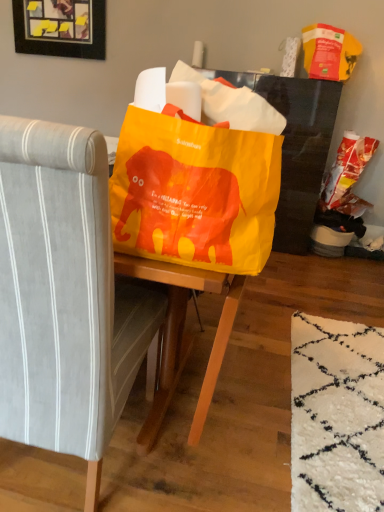
At what (x,y) coordinates should I click in order to perform the action: click on yellow plastic grocery bag at upper right, arranged as the first grocery bag when viewed from the top. Please return your answer as a coordinate pair (x, y). Looking at the image, I should click on (329, 52).

Describe the element at coordinates (329, 52) in the screenshot. Image resolution: width=384 pixels, height=512 pixels. I see `yellow plastic grocery bag at upper right, acting as the 2th grocery bag starting from the bottom` at that location.

From the picture: What is the approximate width of matte plastic grocery bag at right, placed as the 2th grocery bag when sorted from top to bottom?

The width of matte plastic grocery bag at right, placed as the 2th grocery bag when sorted from top to bottom, is 25.15 centimeters.

At what (x,y) coordinates should I click in order to perform the action: click on matte plastic grocery bag at right, which is the first grocery bag in bottom-to-top order. Please return your answer as a coordinate pair (x, y). Looking at the image, I should click on (348, 175).

This screenshot has width=384, height=512. I want to click on wooden frame with yellow sticky notes at upper left, so click(x=60, y=28).

Image resolution: width=384 pixels, height=512 pixels. Identify the location of yellow plastic grocery bag at upper right, acting as the 2th grocery bag starting from the bottom. (329, 52).

Which object is closer to the camera taking this photo, yellow plastic grocery bag at upper right, acting as the 2th grocery bag starting from the bottom, or wooden frame with yellow sticky notes at upper left?

yellow plastic grocery bag at upper right, acting as the 2th grocery bag starting from the bottom, is in front.

Consider the image. Is yellow plastic grocery bag at upper right, arranged as the first grocery bag when viewed from the top, positioned beyond the bounds of wooden frame with yellow sticky notes at upper left?

Yes, yellow plastic grocery bag at upper right, arranged as the first grocery bag when viewed from the top, is not within wooden frame with yellow sticky notes at upper left.

Looking at the image, does yellow plastic grocery bag at upper right, acting as the 2th grocery bag starting from the bottom, seem bigger or smaller compared to wooden frame with yellow sticky notes at upper left?

Considering their sizes, yellow plastic grocery bag at upper right, acting as the 2th grocery bag starting from the bottom, takes up more space than wooden frame with yellow sticky notes at upper left.

Consider the image. From the image's perspective, which one is positioned lower, wooden frame with yellow sticky notes at upper left or matte plastic grocery bag at right, which is the first grocery bag in bottom-to-top order?

From the image's view, matte plastic grocery bag at right, which is the first grocery bag in bottom-to-top order, is below.

Which of these two, wooden frame with yellow sticky notes at upper left or matte plastic grocery bag at right, placed as the 2th grocery bag when sorted from top to bottom, stands shorter?

wooden frame with yellow sticky notes at upper left is shorter.

Can you confirm if wooden frame with yellow sticky notes at upper left is thinner than matte plastic grocery bag at right, which is the first grocery bag in bottom-to-top order?

Yes.

Is wooden frame with yellow sticky notes at upper left positioned far away from matte plastic grocery bag at right, placed as the 2th grocery bag when sorted from top to bottom?

Yes, wooden frame with yellow sticky notes at upper left and matte plastic grocery bag at right, placed as the 2th grocery bag when sorted from top to bottom, are located far from each other.

Would you consider matte plastic grocery bag at right, placed as the 2th grocery bag when sorted from top to bottom, to be distant from gray fabric chair at center?

Yes, matte plastic grocery bag at right, placed as the 2th grocery bag when sorted from top to bottom, and gray fabric chair at center are quite far apart.

Considering the sizes of matte plastic grocery bag at right, which is the first grocery bag in bottom-to-top order, and gray fabric chair at center in the image, is matte plastic grocery bag at right, which is the first grocery bag in bottom-to-top order, wider or thinner than gray fabric chair at center?

matte plastic grocery bag at right, which is the first grocery bag in bottom-to-top order, is thinner than gray fabric chair at center.

Does matte plastic grocery bag at right, placed as the 2th grocery bag when sorted from top to bottom, appear on the left side of gray fabric chair at center?

Incorrect, matte plastic grocery bag at right, placed as the 2th grocery bag when sorted from top to bottom, is not on the left side of gray fabric chair at center.

Based on the photo, from the image's perspective, is matte plastic grocery bag at right, which is the first grocery bag in bottom-to-top order, beneath gray fabric chair at center?

No, from the image's perspective, matte plastic grocery bag at right, which is the first grocery bag in bottom-to-top order, is not beneath gray fabric chair at center.

Is point (97, 49) closer to viewer compared to point (325, 42)?

That is False.

How different are the orientations of wooden frame with yellow sticky notes at upper left and yellow plastic grocery bag at upper right, arranged as the first grocery bag when viewed from the top, in degrees?

0.00758 degrees separate the facing orientations of wooden frame with yellow sticky notes at upper left and yellow plastic grocery bag at upper right, arranged as the first grocery bag when viewed from the top.

Measure the distance between wooden frame with yellow sticky notes at upper left and yellow plastic grocery bag at upper right, acting as the 2th grocery bag starting from the bottom.

wooden frame with yellow sticky notes at upper left and yellow plastic grocery bag at upper right, acting as the 2th grocery bag starting from the bottom, are 6.35 feet apart.

Which object is positioned more to the left, wooden frame with yellow sticky notes at upper left or yellow plastic grocery bag at upper right, acting as the 2th grocery bag starting from the bottom?

Positioned to the left is wooden frame with yellow sticky notes at upper left.

Considering their positions, is matte plastic grocery bag at right, placed as the 2th grocery bag when sorted from top to bottom, located in front of or behind wooden frame with yellow sticky notes at upper left?

Visually, matte plastic grocery bag at right, placed as the 2th grocery bag when sorted from top to bottom, is located in front of wooden frame with yellow sticky notes at upper left.

From the image's perspective, relative to wooden frame with yellow sticky notes at upper left, is matte plastic grocery bag at right, which is the first grocery bag in bottom-to-top order, above or below?

Based on their image positions, matte plastic grocery bag at right, which is the first grocery bag in bottom-to-top order, is located beneath wooden frame with yellow sticky notes at upper left.

From a real-world perspective, who is located higher, matte plastic grocery bag at right, which is the first grocery bag in bottom-to-top order, or wooden frame with yellow sticky notes at upper left?

wooden frame with yellow sticky notes at upper left, from a real-world perspective.

Does point (347, 158) lie in front of point (73, 22)?

Yes, point (347, 158) is in front of point (73, 22).

From a real-world perspective, is matte plastic grocery bag at right, which is the first grocery bag in bottom-to-top order, physically above yellow plastic grocery bag at upper right, acting as the 2th grocery bag starting from the bottom?

No, from a real-world perspective, matte plastic grocery bag at right, which is the first grocery bag in bottom-to-top order, is not on top of yellow plastic grocery bag at upper right, acting as the 2th grocery bag starting from the bottom.

Considering the sizes of objects matte plastic grocery bag at right, which is the first grocery bag in bottom-to-top order, and yellow plastic grocery bag at upper right, acting as the 2th grocery bag starting from the bottom, in the image provided, who is shorter, matte plastic grocery bag at right, which is the first grocery bag in bottom-to-top order, or yellow plastic grocery bag at upper right, acting as the 2th grocery bag starting from the bottom,?

yellow plastic grocery bag at upper right, acting as the 2th grocery bag starting from the bottom.

Considering the relative positions of matte plastic grocery bag at right, placed as the 2th grocery bag when sorted from top to bottom, and yellow plastic grocery bag at upper right, acting as the 2th grocery bag starting from the bottom, in the image provided, is matte plastic grocery bag at right, placed as the 2th grocery bag when sorted from top to bottom, to the left or to the right of yellow plastic grocery bag at upper right, acting as the 2th grocery bag starting from the bottom,?

matte plastic grocery bag at right, placed as the 2th grocery bag when sorted from top to bottom, is positioned on yellow plastic grocery bag at upper right, acting as the 2th grocery bag starting from the bottom,'s right side.

Considering the sizes of matte plastic grocery bag at right, which is the first grocery bag in bottom-to-top order, and yellow plastic grocery bag at upper right, arranged as the first grocery bag when viewed from the top, in the image, is matte plastic grocery bag at right, which is the first grocery bag in bottom-to-top order, wider or thinner than yellow plastic grocery bag at upper right, arranged as the first grocery bag when viewed from the top,?

Clearly, matte plastic grocery bag at right, which is the first grocery bag in bottom-to-top order, has less width compared to yellow plastic grocery bag at upper right, arranged as the first grocery bag when viewed from the top.

Considering the relative sizes of wooden frame with yellow sticky notes at upper left and gray fabric chair at center in the image provided, is wooden frame with yellow sticky notes at upper left wider than gray fabric chair at center?

In fact, wooden frame with yellow sticky notes at upper left might be narrower than gray fabric chair at center.

Find the location of a particular element. chair on the right side of wooden frame with yellow sticky notes at upper left is located at coordinates (65, 297).

Does wooden frame with yellow sticky notes at upper left have a greater height compared to gray fabric chair at center?

In fact, wooden frame with yellow sticky notes at upper left may be shorter than gray fabric chair at center.

Based on the photo, is wooden frame with yellow sticky notes at upper left far away from gray fabric chair at center?

Indeed, wooden frame with yellow sticky notes at upper left is not near gray fabric chair at center.

At what (x,y) coordinates should I click in order to perform the action: click on the 1st grocery bag located beneath the wooden frame with yellow sticky notes at upper left (from a real-world perspective). Please return your answer as a coordinate pair (x, y). Looking at the image, I should click on (329, 52).

You are a GUI agent. You are given a task and a screenshot of the screen. Output one action in this format:
    pyautogui.click(x=<x>, y=<y>)
    Task: Click on the 2nd grocery bag to the right of the wooden frame with yellow sticky notes at upper left, starting your count from the anchor
    The height and width of the screenshot is (512, 384).
    Given the screenshot: What is the action you would take?
    pyautogui.click(x=348, y=175)

When comparing their distances from matte plastic grocery bag at right, placed as the 2th grocery bag when sorted from top to bottom, does gray fabric chair at center or yellow plastic grocery bag at upper right, acting as the 2th grocery bag starting from the bottom, seem further?

Among the two, gray fabric chair at center is located further to matte plastic grocery bag at right, placed as the 2th grocery bag when sorted from top to bottom.

Estimate the real-world distances between objects in this image. Which object is closer to matte plastic grocery bag at right, placed as the 2th grocery bag when sorted from top to bottom, wooden frame with yellow sticky notes at upper left or yellow plastic grocery bag at upper right, arranged as the first grocery bag when viewed from the top?

yellow plastic grocery bag at upper right, arranged as the first grocery bag when viewed from the top, is positioned closer to the anchor matte plastic grocery bag at right, placed as the 2th grocery bag when sorted from top to bottom.

Estimate the real-world distances between objects in this image. Which object is closer to gray fabric chair at center, matte plastic grocery bag at right, placed as the 2th grocery bag when sorted from top to bottom, or wooden frame with yellow sticky notes at upper left?

Based on the image, matte plastic grocery bag at right, placed as the 2th grocery bag when sorted from top to bottom, appears to be nearer to gray fabric chair at center.

From the image, which object appears to be farther from gray fabric chair at center, wooden frame with yellow sticky notes at upper left or yellow plastic grocery bag at upper right, arranged as the first grocery bag when viewed from the top?

wooden frame with yellow sticky notes at upper left lies further to gray fabric chair at center than the other object.

Which object lies further to the anchor point yellow plastic grocery bag at upper right, acting as the 2th grocery bag starting from the bottom, gray fabric chair at center or matte plastic grocery bag at right, placed as the 2th grocery bag when sorted from top to bottom?

gray fabric chair at center.

Which object lies nearer to the anchor point matte plastic grocery bag at right, placed as the 2th grocery bag when sorted from top to bottom, gray fabric chair at center or wooden frame with yellow sticky notes at upper left?

wooden frame with yellow sticky notes at upper left is positioned closer to the anchor matte plastic grocery bag at right, placed as the 2th grocery bag when sorted from top to bottom.

Considering their positions, is wooden frame with yellow sticky notes at upper left positioned closer to yellow plastic grocery bag at upper right, acting as the 2th grocery bag starting from the bottom, than gray fabric chair at center?

The object closer to yellow plastic grocery bag at upper right, acting as the 2th grocery bag starting from the bottom, is wooden frame with yellow sticky notes at upper left.

From the image, which object appears to be farther from wooden frame with yellow sticky notes at upper left, matte plastic grocery bag at right, placed as the 2th grocery bag when sorted from top to bottom, or gray fabric chair at center?

Based on the image, gray fabric chair at center appears to be further to wooden frame with yellow sticky notes at upper left.

Image resolution: width=384 pixels, height=512 pixels. I want to click on grocery bag positioned between gray fabric chair at center and matte plastic grocery bag at right, placed as the 2th grocery bag when sorted from top to bottom, from near to far, so click(x=329, y=52).

You are a GUI agent. You are given a task and a screenshot of the screen. Output one action in this format:
    pyautogui.click(x=<x>, y=<y>)
    Task: Click on the grocery bag between wooden frame with yellow sticky notes at upper left and matte plastic grocery bag at right, placed as the 2th grocery bag when sorted from top to bottom, in the horizontal direction
    The image size is (384, 512).
    Given the screenshot: What is the action you would take?
    pyautogui.click(x=329, y=52)